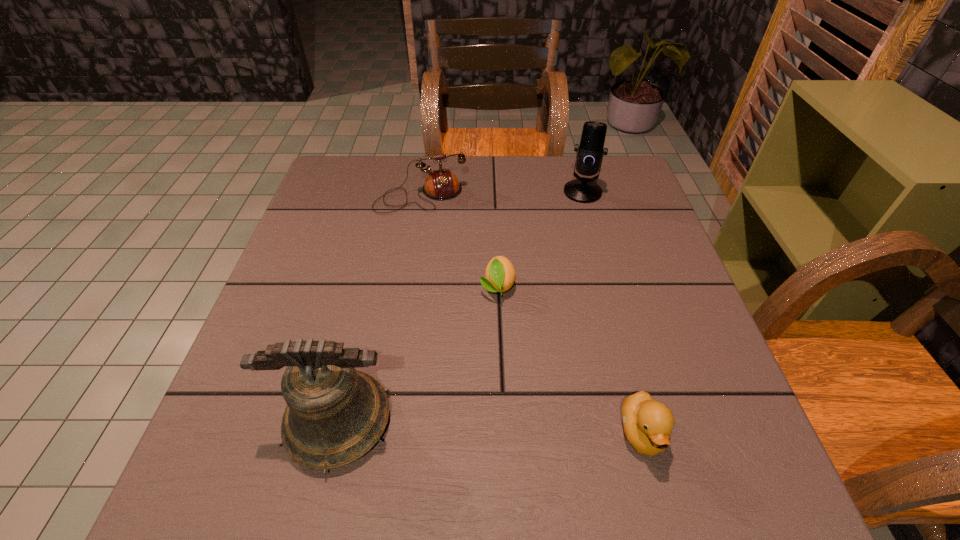
At what (x,y) coordinates should I click in order to perform the action: click on vacant space located 0.080m on the stand of the microphone. Please return your answer as a coordinate pair (x, y). Looking at the image, I should click on (567, 219).

Identify the location of vacant space located on the stand of the microphone. (561, 230).

Identify the location of free point located on the stand of the microphone. (543, 259).

Find the location of a particular element. vacant region located 0.230m on the rotary dial of the telephone is located at coordinates (449, 275).

Find the location of a particular element. The height and width of the screenshot is (540, 960). free space located on the rotary dial of the telephone is located at coordinates (437, 233).

This screenshot has height=540, width=960. What are the coordinates of `free space located 0.250m on the rotary dial of the telephone` in the screenshot? It's located at (451, 281).

Where is `microphone at the far edge`? This screenshot has height=540, width=960. microphone at the far edge is located at coordinates (590, 152).

Locate an element on the screen. telephone located at the far edge is located at coordinates (442, 184).

At what (x,y) coordinates should I click in order to perform the action: click on bell at the near edge. Please return your answer as a coordinate pair (x, y). The image size is (960, 540). Looking at the image, I should click on pos(335,414).

Identify the location of duckling that is at the near edge. The width and height of the screenshot is (960, 540). (647, 423).